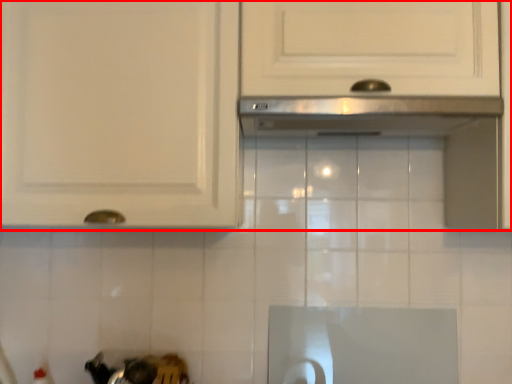
Question: From the image's perspective, what is the correct spatial positioning of cabinetry (annotated by the red box) in reference to exhaust hood?

Choices:
 (A) below
 (B) above

Answer: (B)